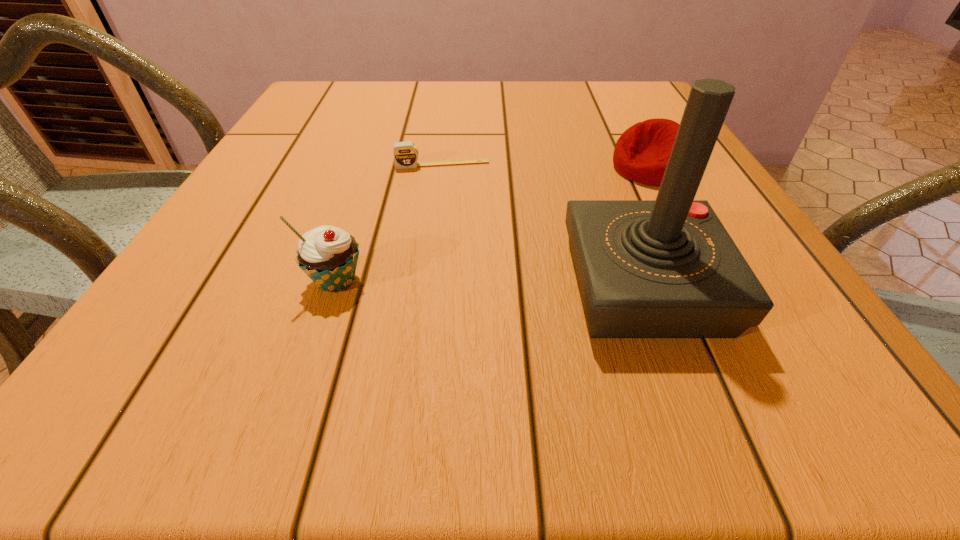
Locate an element on the screen. This screenshot has width=960, height=540. vacant space on the desktop that is between the second tallest object and the joystick and is positioned at the front of the shortest object with the tape extended is located at coordinates tap(454, 283).

Where is `vacant space on the desktop that is between the cupcake and the joystick and is positioned on the seat area of the third tallest object`? vacant space on the desktop that is between the cupcake and the joystick and is positioned on the seat area of the third tallest object is located at coordinates (471, 283).